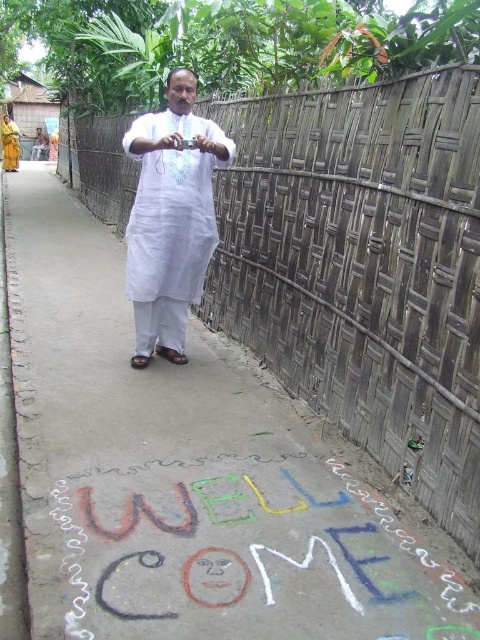
Question: Which of the following is the farthest from the observer?

Choices:
 (A) yellow fabric robe at left
 (B) chalky multicolored welcome sign at center
 (C) wooden at center
 (D) white cotton kurta at center

Answer: (A)

Question: Which object appears farthest from the camera in this image?

Choices:
 (A) white cotton kurta at center
 (B) chalky multicolored welcome sign at center

Answer: (A)

Question: Is wooden at center further to camera compared to yellow fabric robe at left?

Choices:
 (A) no
 (B) yes

Answer: (A)

Question: Is white cotton kurta at center thinner than yellow fabric robe at left?

Choices:
 (A) no
 (B) yes

Answer: (B)

Question: Is wooden at center smaller than white cotton kurta at center?

Choices:
 (A) no
 (B) yes

Answer: (A)

Question: Which of these objects is positioned farthest from the wooden at center?

Choices:
 (A) chalky multicolored welcome sign at center
 (B) yellow fabric robe at left
 (C) white cotton kurta at center

Answer: (B)